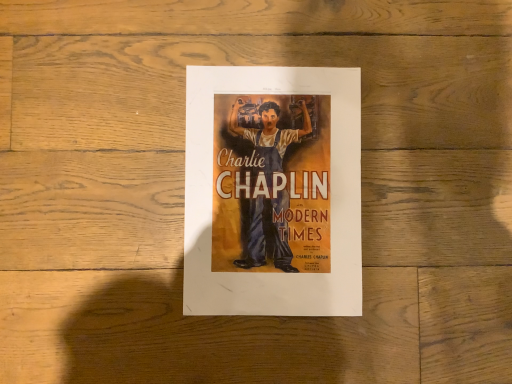
Locate an element on the screen. This screenshot has height=384, width=512. empty space that is ontop of matte paper poster at center (from a real-world perspective) is located at coordinates (267, 185).